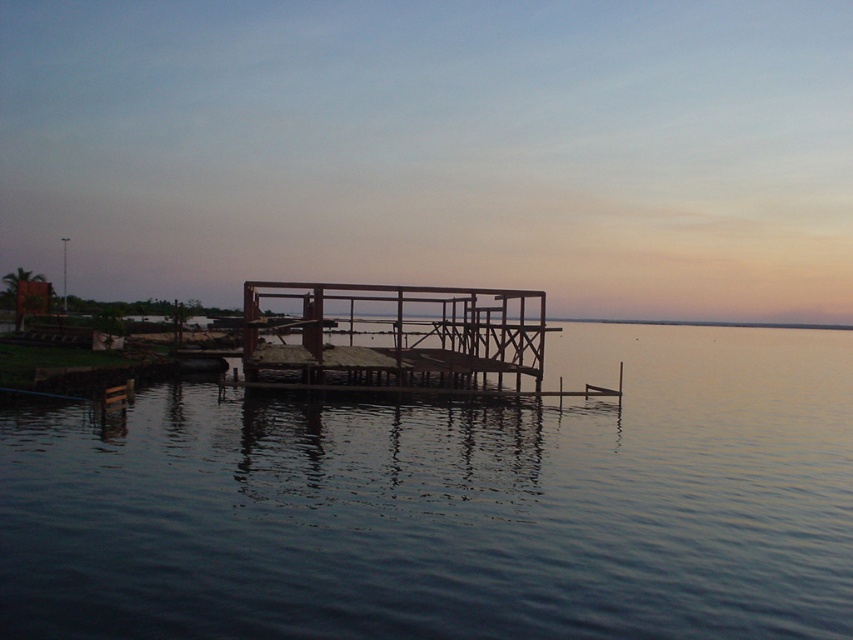
You are standing on the wooden dock at center and want to see the transparent water at center. In which direction should you look?

You should look downward to see the transparent water at center because it is located below the wooden dock at center.

You are standing on the wooden dock at center and want to jump into the transparent water at center. Is the water area big enough to safely jump into?

The transparent water at center is smaller than the wooden dock at center, so the water area may not be large enough to safely jump into. Ensure there is enough space before jumping.